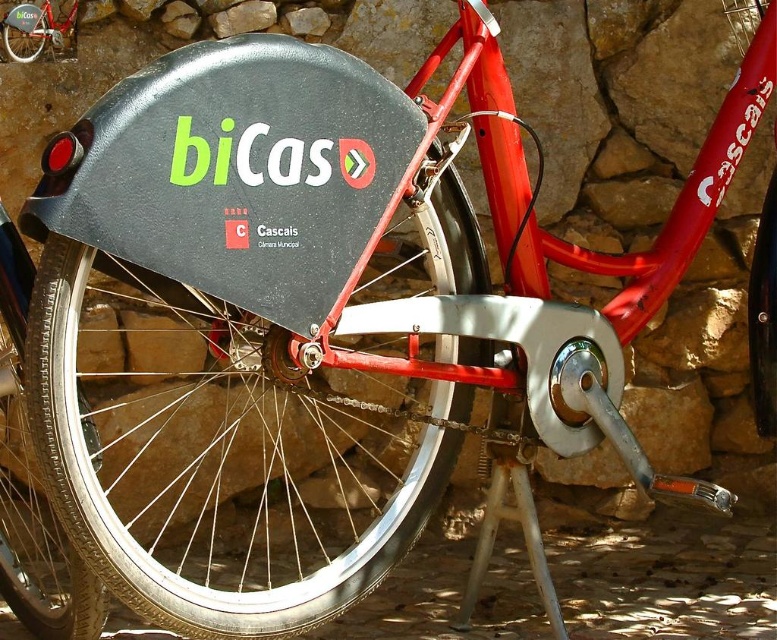
In the scene shown: Which of these two, black rubber tire at lower left or black rubber tire at lower right, stands taller?

With more height is black rubber tire at lower right.

Which is above, black rubber tire at lower left or black rubber tire at lower right?

black rubber tire at lower right

Is point (12, 464) more distant than point (768, 257)?

Yes, it is.

Where is `black rubber tire at lower left`? The image size is (777, 640). black rubber tire at lower left is located at coordinates (39, 547).

Between black rubber tire at center and matte red bicycle at center, which one has less height?

matte red bicycle at center is shorter.

At what (x,y) coordinates should I click in order to perform the action: click on black rubber tire at center. Please return your answer as a coordinate pair (x, y). Image resolution: width=777 pixels, height=640 pixels. Looking at the image, I should click on (220, 452).

Which of these two, black rubber tire at center or black rubber tire at lower right, stands shorter?

With less height is black rubber tire at lower right.

Between black rubber tire at center and black rubber tire at lower right, which one has more height?

black rubber tire at center is taller.

Is point (235, 589) more distant than point (767, 211)?

Yes, point (235, 589) is behind point (767, 211).

Find the location of a particular element. black rubber tire at center is located at coordinates (220, 452).